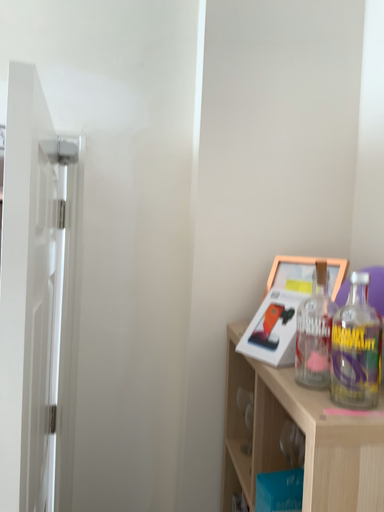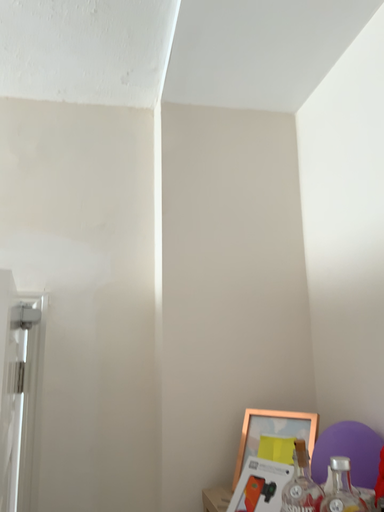
Question: Which way did the camera rotate in the video?

Choices:
 (A) rotated upward
 (B) rotated downward

Answer: (A)